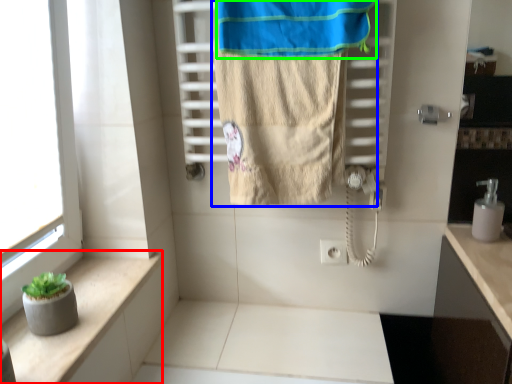
Question: Based on their relative distances, which object is farther from balustrade (highlighted by a red box)? Choose from towel (highlighted by a blue box) and beach towel (highlighted by a green box).

Choices:
 (A) towel
 (B) beach towel

Answer: (B)